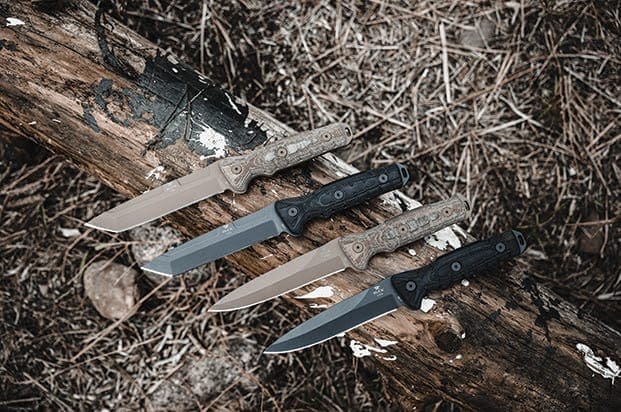
Find the location of a particular element. 2 black handles is located at coordinates [x=356, y=195].